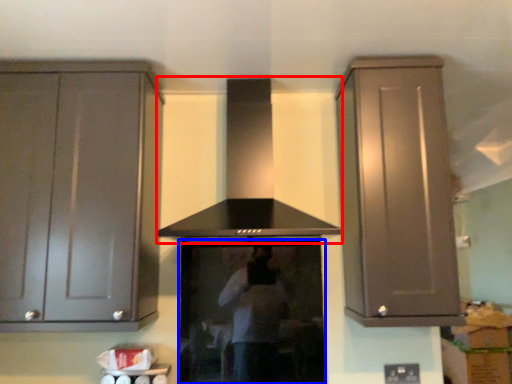
Question: Which object appears closest to the camera in this image, vent (highlighted by a red box) or appliance (highlighted by a blue box)?

Choices:
 (A) vent
 (B) appliance

Answer: (A)